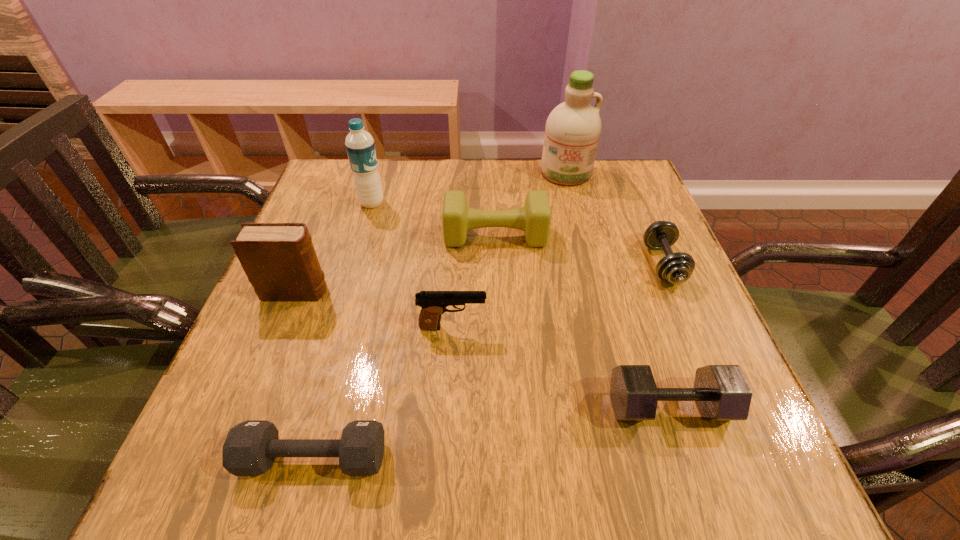
Choose which object is the nearest neighbor to the cleansing agent. Please provide its 2D coordinates. Your answer should be formatted as a tuple, i.e. [(x, y)], where the tuple contains the x and y coordinates of a point satisfying the conditions above.

[(534, 218)]

Locate which object ranks fifth in proximity to the leftmost dumbbell. Please provide its 2D coordinates. Your answer should be formatted as a tuple, i.e. [(x, y)], where the tuple contains the x and y coordinates of a point satisfying the conditions above.

[(360, 146)]

Choose which dumbbell is the nearest neighbor to the tallest dumbbell. Please provide its 2D coordinates. Your answer should be formatted as a tuple, i.e. [(x, y)], where the tuple contains the x and y coordinates of a point satisfying the conditions above.

[(676, 268)]

Where is `dumbbell that is the third closest to the pistol`? This screenshot has height=540, width=960. dumbbell that is the third closest to the pistol is located at coordinates (722, 393).

I want to click on free space that satisfies the following two spatial constraints: 1. on the front label of the tallest object; 2. at the barrel of the pistol, so tap(605, 327).

Where is `vacant region that satisfies the following two spatial constraints: 1. on the front label of the seventh farthest object; 2. on the left side of the tallest object`? The image size is (960, 540). vacant region that satisfies the following two spatial constraints: 1. on the front label of the seventh farthest object; 2. on the left side of the tallest object is located at coordinates (625, 407).

Locate an element on the screen. free space that satisfies the following two spatial constraints: 1. on the back side of the second nearest dumbbell; 2. on the spine side of the diary is located at coordinates coord(631,292).